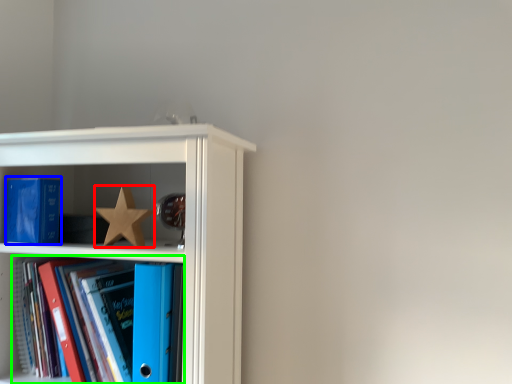
Question: Estimate the real-world distances between objects in this image. Which object is closer to star (highlighted by a red box), paperback book (highlighted by a blue box) or book (highlighted by a green box)?

Choices:
 (A) paperback book
 (B) book

Answer: (A)